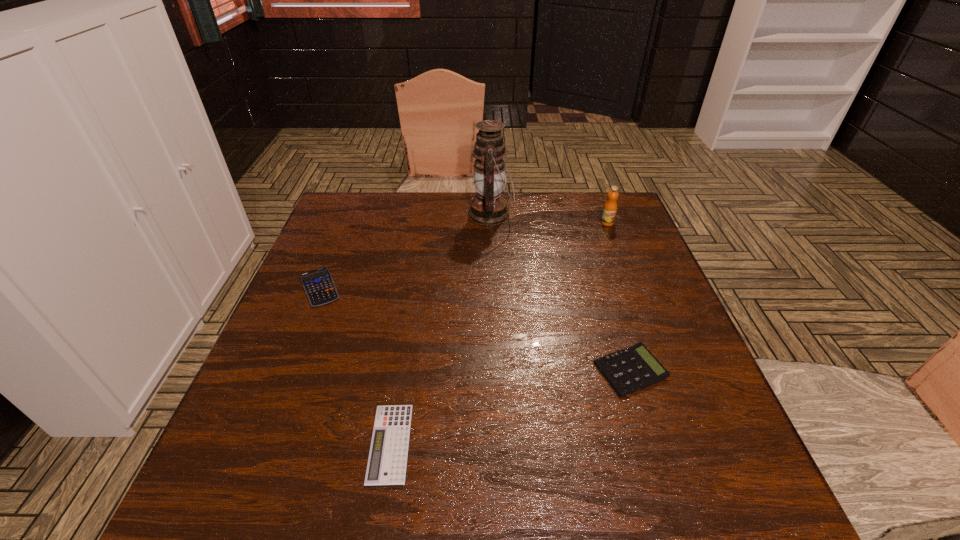
Locate an element on the screen. the third object from left to right is located at coordinates (488, 208).

At what (x,y) coordinates should I click in order to perform the action: click on the tallest object. Please return your answer as a coordinate pair (x, y). The image size is (960, 540). Looking at the image, I should click on (488, 208).

Find the location of a particular element. orange juice is located at coordinates (609, 211).

Where is `the second nearest calculator`? This screenshot has width=960, height=540. the second nearest calculator is located at coordinates (631, 369).

Where is `the rightmost calculator`? the rightmost calculator is located at coordinates (631, 369).

Find the location of a particular element. The width and height of the screenshot is (960, 540). the fourth tallest object is located at coordinates point(318,284).

Where is `the leftmost calculator`? This screenshot has height=540, width=960. the leftmost calculator is located at coordinates (318, 284).

Find the location of `the nearest object`. the nearest object is located at coordinates (387, 460).

Locate an element on the screen. The height and width of the screenshot is (540, 960). the nearest calculator is located at coordinates (387, 460).

Find the location of `free space located on the right of the tallest object`. free space located on the right of the tallest object is located at coordinates (586, 214).